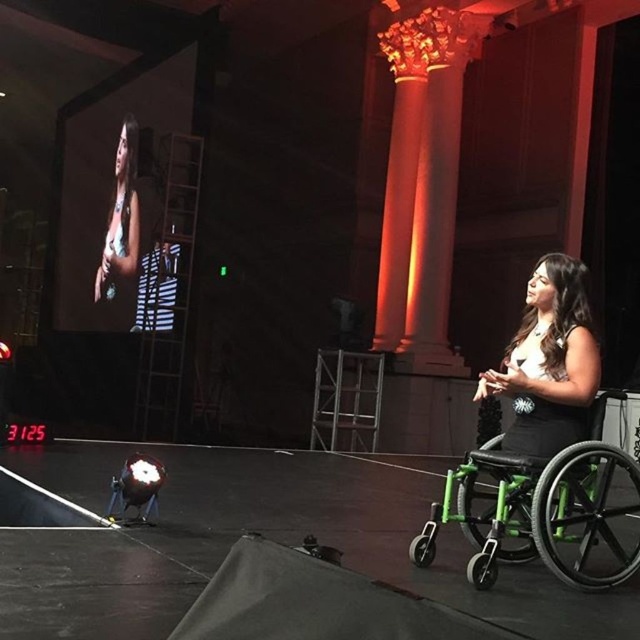
Question: Which point is closer to the camera taking this photo?

Choices:
 (A) (548, 419)
 (B) (259, 483)

Answer: (A)

Question: Is black matte wheelchair at lower right above matte black dress at upper left?

Choices:
 (A) yes
 (B) no

Answer: (B)

Question: Is metallic green wheelchair at lower right to the right of matte black dress at upper left from the viewer's perspective?

Choices:
 (A) yes
 (B) no

Answer: (A)

Question: Among these objects, which one is nearest to the camera?

Choices:
 (A) green plastic wheelchair at right
 (B) metallic green wheelchair at lower right
 (C) matte black dress at upper left

Answer: (B)

Question: Is green plastic wheelchair at right positioned behind matte black dress at upper left?

Choices:
 (A) yes
 (B) no

Answer: (B)

Question: Which point is closer to the camera?

Choices:
 (A) (113, 230)
 (B) (196, 547)
 (C) (449, 513)
 (D) (580, 428)

Answer: (D)